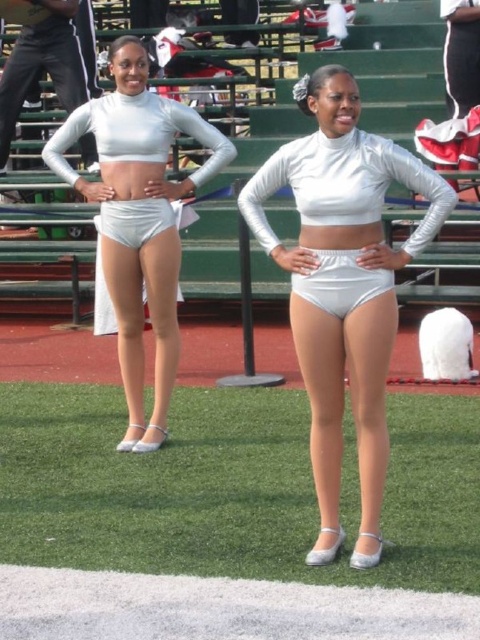
You are a photographer positioned at the front of the stadium, and you want to capture a photo that includes both point (165, 150) and point (352, 289). Which point should you focus on first to ensure both are in sharp focus?

You should focus on point (165, 150) first because it is closer to the camera than point (352, 289). By focusing on the closer point, the farther point may still be within the depth of field, ensuring both are in focus.

You are a costume designer preparing for a cheerleading performance. You need to ensure that the silver metallic shorts at center and the white matte underwear at center are positioned appropriately for the performance. Based on the given distance between them, can you confirm if the underwear is visible from the audience seated in the bleachers?

The distance between the silver metallic shorts at center and the white matte underwear at center is 5.80 feet. At this distance, the white matte underwear at center may be visible to the audience in the bleachers, depending on the angle and positioning during the performance.